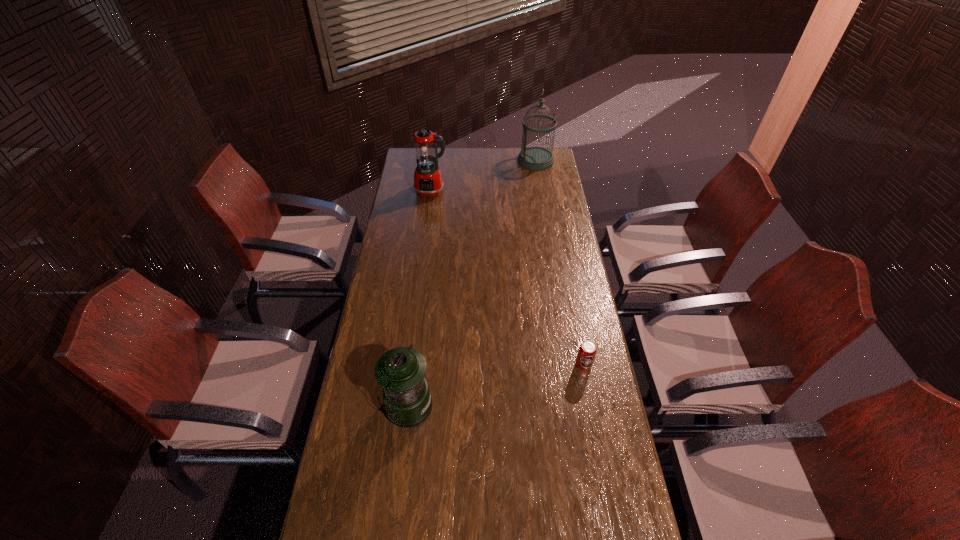
In order to click on vacant area that lies between the third tallest object and the soda in this screenshot , I will do `click(495, 385)`.

Image resolution: width=960 pixels, height=540 pixels. I want to click on free point between the tallest object and the second farthest object, so click(x=484, y=176).

Image resolution: width=960 pixels, height=540 pixels. What are the coordinates of `vacant space that's between the lantern and the second farthest object` in the screenshot? It's located at (420, 299).

This screenshot has height=540, width=960. In order to click on the second closest object to the second tallest object in this screenshot , I will do `click(401, 371)`.

In order to click on object that stands as the closest to the food processor in this screenshot , I will do `click(534, 158)`.

This screenshot has height=540, width=960. I want to click on vacant region that satisfies the following two spatial constraints: 1. on the front-facing side of the tallest object; 2. on the controls of the food processor, so click(x=541, y=192).

Where is `free space that satisfies the following two spatial constraints: 1. on the controls of the second nearest object; 2. on the right side of the second tallest object`? free space that satisfies the following two spatial constraints: 1. on the controls of the second nearest object; 2. on the right side of the second tallest object is located at coordinates (408, 364).

The width and height of the screenshot is (960, 540). Find the location of `vacant position in the image that satisfies the following two spatial constraints: 1. on the front-facing side of the tallest object; 2. on the controls of the second tallest object`. vacant position in the image that satisfies the following two spatial constraints: 1. on the front-facing side of the tallest object; 2. on the controls of the second tallest object is located at coordinates (541, 192).

Locate an element on the screen. free space in the image that satisfies the following two spatial constraints: 1. on the front-facing side of the shortest object; 2. on the right side of the farthest object is located at coordinates (569, 364).

The height and width of the screenshot is (540, 960). I want to click on vacant region that satisfies the following two spatial constraints: 1. on the front-facing side of the birdcage; 2. on the right side of the soda, so click(569, 364).